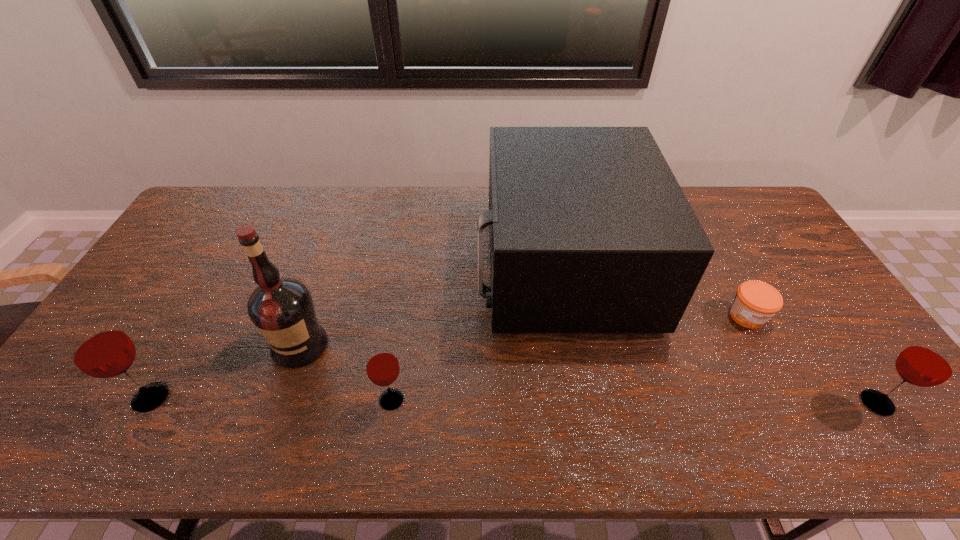
Identify the location of object located in the near right corner section of the desktop. (931, 361).

Locate an element on the screen. The width and height of the screenshot is (960, 540). free location at the far edge is located at coordinates (262, 207).

In the image, there is a desktop. Where is `vacant space at the near edge`? vacant space at the near edge is located at coordinates (470, 403).

In the image, there is a desktop. Identify the location of free space at the right edge. The height and width of the screenshot is (540, 960). (764, 239).

Identify the location of vacant area at the far left corner of the desktop. (230, 210).

Where is `vacant region between the rightmost glass and the third object from left to right`? The width and height of the screenshot is (960, 540). vacant region between the rightmost glass and the third object from left to right is located at coordinates (635, 401).

The image size is (960, 540). I want to click on vacant point located between the fifth object from right to left and the microwave oven, so [x=430, y=305].

The width and height of the screenshot is (960, 540). I want to click on free space that is in between the leftmost glass and the microwave oven, so click(x=356, y=332).

Locate an element on the screen. Image resolution: width=960 pixels, height=540 pixels. free space between the fifth object from right to left and the third object from left to right is located at coordinates (346, 373).

Where is `free area in between the leftmost object and the fifth object from right to left`? The width and height of the screenshot is (960, 540). free area in between the leftmost object and the fifth object from right to left is located at coordinates (226, 372).